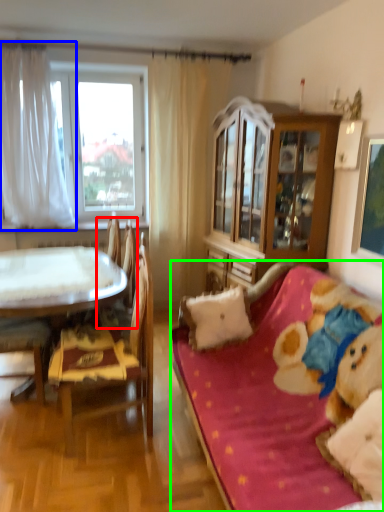
Question: Which object is the farthest from armchair (highlighted by a red box)? Choose among these: curtain (highlighted by a blue box) or studio couch (highlighted by a green box).

Choices:
 (A) curtain
 (B) studio couch

Answer: (B)